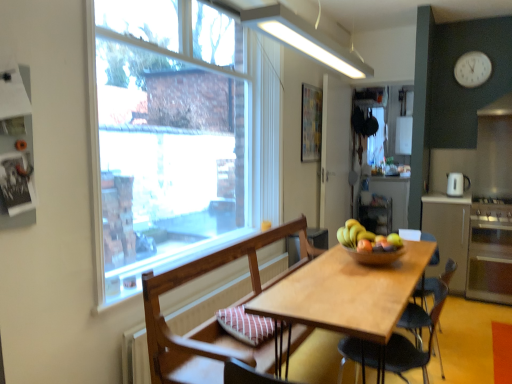
Question: From a real-world perspective, is satin silver oven at right above or below matte white cabinet at right?

Choices:
 (A) below
 (B) above

Answer: (A)

Question: Do you think satin silver oven at right is within matte white cabinet at right, or outside of it?

Choices:
 (A) outside
 (B) inside

Answer: (A)

Question: Considering the real-world distances, which object is farthest from the clear glass window at upper left?

Choices:
 (A) white plastic clock at upper right
 (B) red matte apple at center
 (C) white glossy refrigerator at upper right
 (D) satin silver stove at right
 (E) abstract painting at upper right

Answer: (A)

Question: Which object is positioned closest to the wooden bowl at center?

Choices:
 (A) red matte apple at center
 (B) satin silver oven at right
 (C) white glossy refrigerator at upper right
 (D) satin silver stove at right
 (E) matte white cabinet at right

Answer: (A)